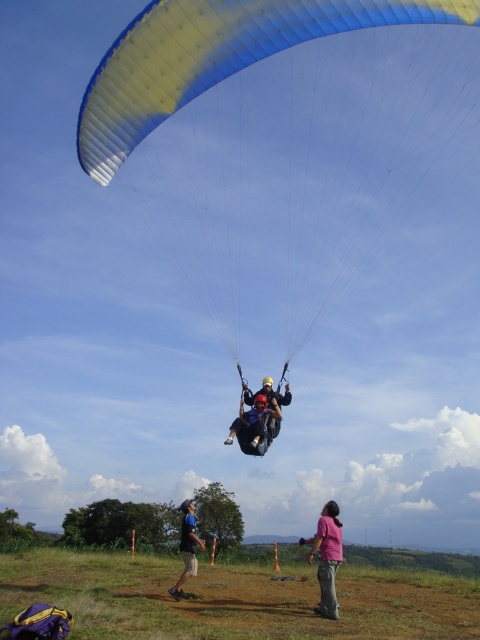
Is matte blue helmet at center below blue fabric parachute at upper center?

No.

This screenshot has width=480, height=640. In order to click on matte blue helmet at center in this screenshot , I will do `click(252, 422)`.

Between point (253, 401) and point (187, 506), which one is positioned in front?

Point (253, 401)

I want to click on matte blue helmet at center, so click(x=252, y=422).

Between pink fabric pants at lower center and matte blue helmet at center, which one has more height?

pink fabric pants at lower center is taller.

This screenshot has height=640, width=480. What do you see at coordinates (327, 557) in the screenshot? I see `pink fabric pants at lower center` at bounding box center [327, 557].

Find the location of a particular element. pink fabric pants at lower center is located at coordinates (327, 557).

Between point (254, 417) and point (245, 401), which one is positioned in front?

Positioned in front is point (254, 417).

What do you see at coordinates (252, 422) in the screenshot? I see `matte blue helmet at center` at bounding box center [252, 422].

Between point (249, 413) and point (276, 429), which one is positioned in front?

Point (249, 413) is in front.

Image resolution: width=480 pixels, height=640 pixels. What are the coordinates of `matte blue helmet at center` in the screenshot? It's located at (252, 422).